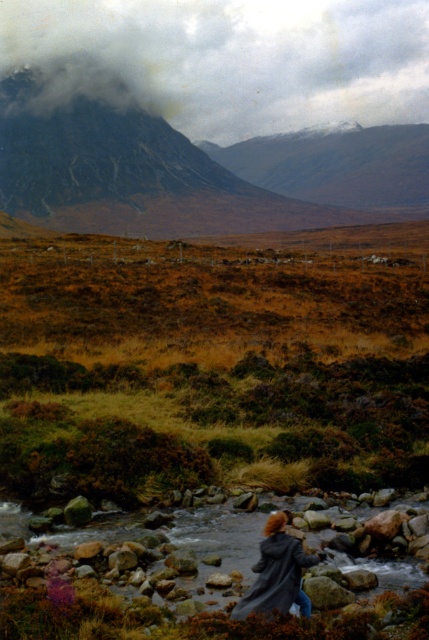
You are a hiker standing at the base of the cloudy gray mountain at upper center. You want to take a photo of the mountain with your smartphone. To do this, you need to position yourself so that the mountain is centered in your camera frame. Given the mountain is located at coordinates 0.094 on the x and 0.536 on the y axis, what direction should you move to center the mountain in your camera view?

The cloudy gray mountain at upper center is located at coordinates 0.094 on the x and 0.536 on the y axis. To center it in your camera view, you should move to the left and slightly downward since the mountain is positioned to the left and lower than the center of the frame.

Based on the scene description, which mountain is bigger between the cloudy gray mountain at upper center and the rugged stone mountain at upper left?

The cloudy gray mountain at upper center is larger in size than the rugged stone mountain at upper left.